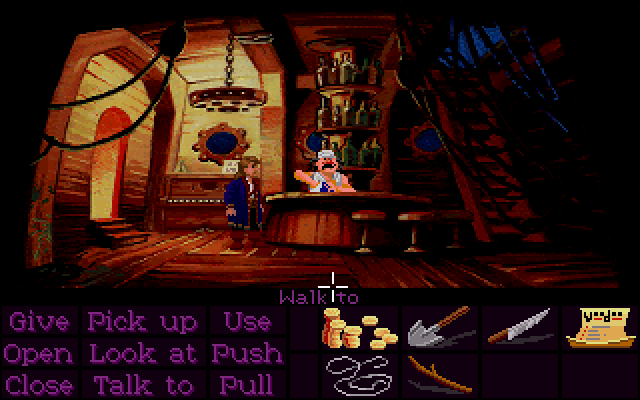
Where is `doorway`? The height and width of the screenshot is (400, 640). doorway is located at coordinates (102, 175).